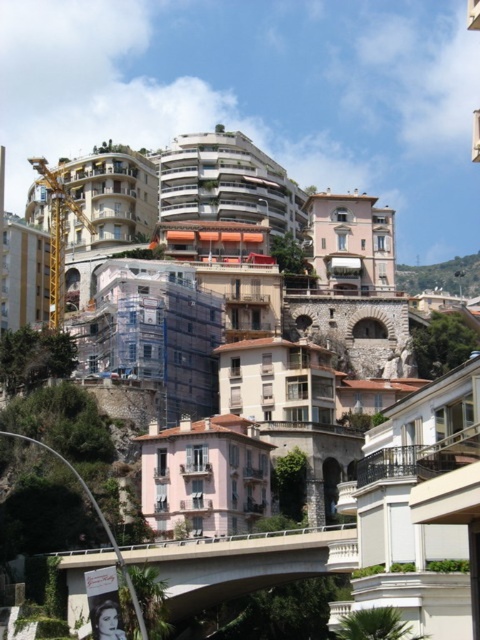
You are standing at the bridge and want to take a photo of both the point at coordinates (63, 301) and the point at coordinates (468, 260). Which point will appear larger in your camera view?

The point at coordinates (63, 301) will appear larger in your camera view because it is closer to the camera than the point at coordinates (468, 260).